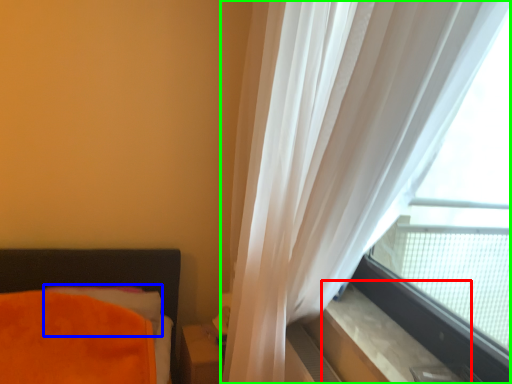
Question: Based on their relative distances, which object is farther from window sill (highlighted by a red box)? Choose from pillow (highlighted by a blue box) and curtain (highlighted by a green box).

Choices:
 (A) pillow
 (B) curtain

Answer: (A)